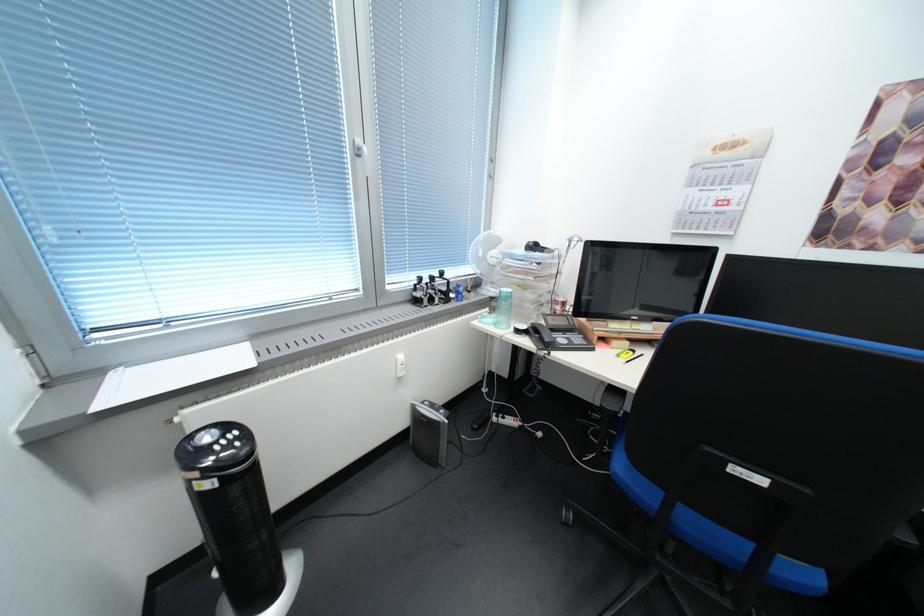
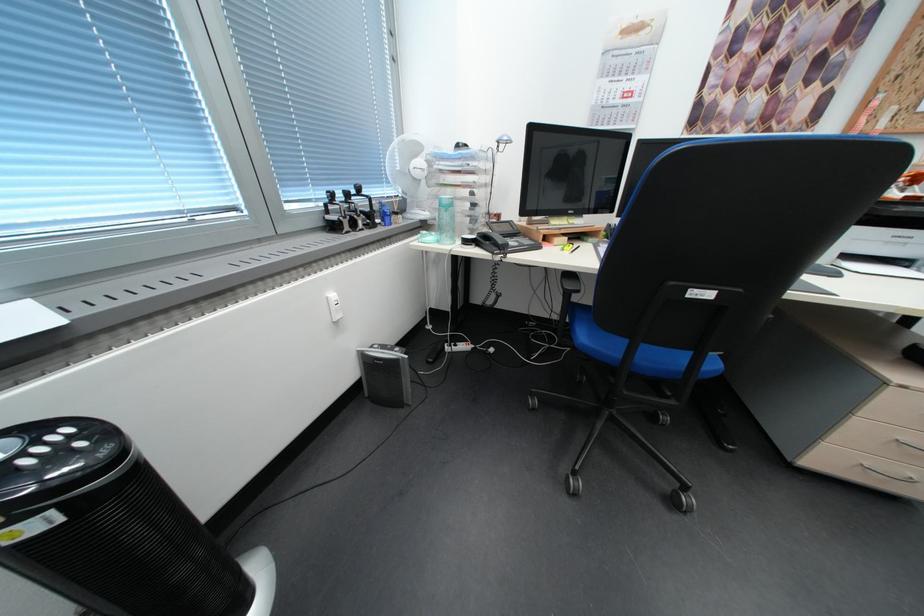
The point at (x=249, y=445) is marked in the first image. Where is the corresponding point in the second image?

(91, 446)